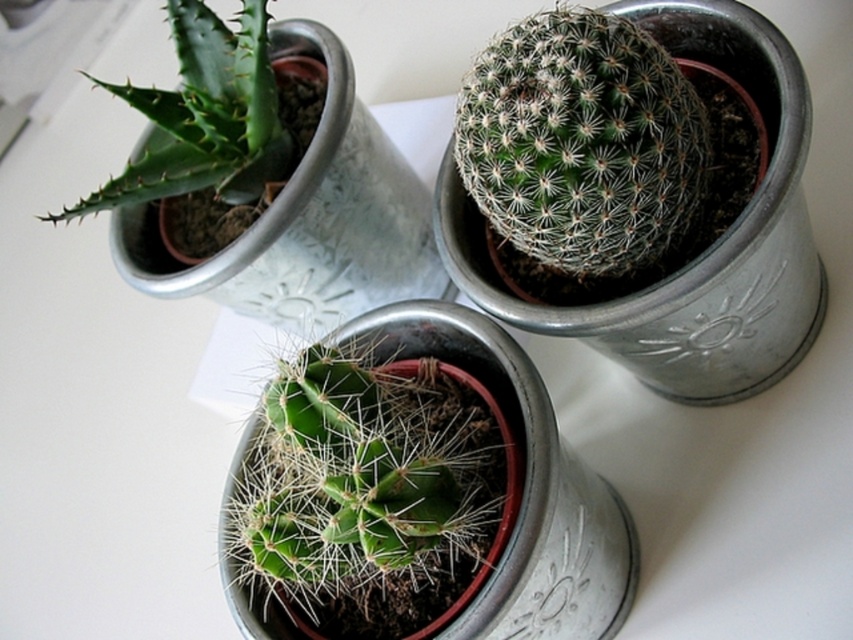
You are a photographer trying to capture the two points in the image. Which point, point (370, 502) or point (250, 29), will appear larger in your photo?

Point (370, 502) is closer to the camera than point (250, 29), so it will appear larger in the photo.

You are standing in front of the three potted cacti. There are two points marked in the image. One is at coordinates point (303,355) and the other is at point (642,116). Which point is closer to you?

Point (303,355) is further to the camera than point (642,116), so the point closer to you is point (642,116).

You are a gardener who wants to water the plants in the image. The watering can you have can only reach 15 inches. Can you water both the green spiny cactus at center and the green spiky plant at upper left without moving the watering can?

The green spiny cactus at center is 17.24 inches away from the green spiky plant at upper left. Since the watering can can only reach 15 inches, you cannot water both without moving it because the distance between them exceeds the can reach.